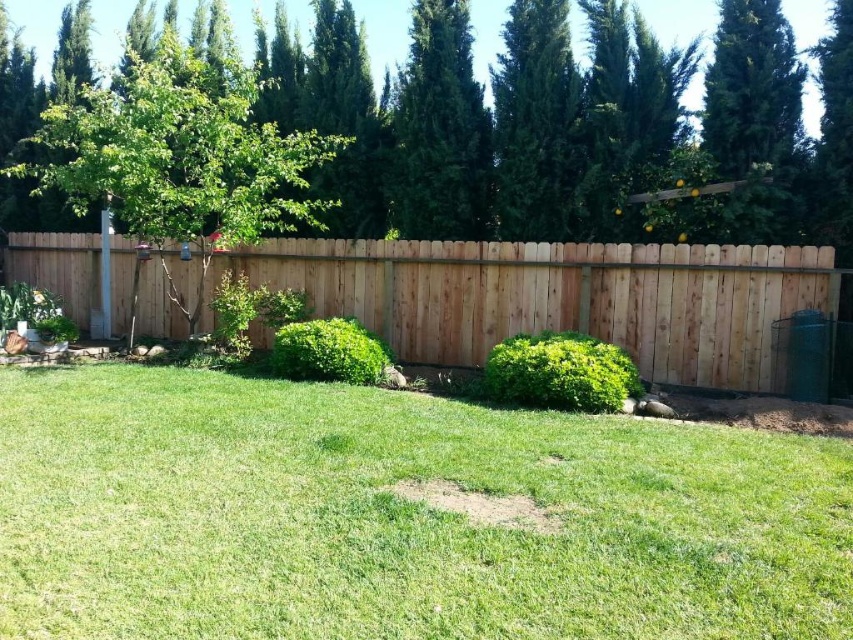
The height and width of the screenshot is (640, 853). What do you see at coordinates (398, 516) in the screenshot?
I see `green grass at center` at bounding box center [398, 516].

What do you see at coordinates (398, 516) in the screenshot? Image resolution: width=853 pixels, height=640 pixels. I see `green grass at center` at bounding box center [398, 516].

The image size is (853, 640). What are the coordinates of `green grass at center` in the screenshot? It's located at (398, 516).

Between point (131, 51) and point (479, 216), which one is positioned behind?

Point (131, 51)

Image resolution: width=853 pixels, height=640 pixels. What do you see at coordinates (180, 157) in the screenshot?
I see `green leafy tree at left` at bounding box center [180, 157].

You are a GUI agent. You are given a task and a screenshot of the screen. Output one action in this format:
    pyautogui.click(x=<x>, y=<y>)
    Task: Click on the green leafy tree at left
    The width and height of the screenshot is (853, 640).
    Given the screenshot: What is the action you would take?
    pyautogui.click(x=180, y=157)

Does green leafy tree at upper center have a larger size compared to green leafy tree at left?

Incorrect, green leafy tree at upper center is not larger than green leafy tree at left.

Can you confirm if green leafy tree at upper center is shorter than green leafy tree at left?

Indeed, green leafy tree at upper center has a lesser height compared to green leafy tree at left.

Does point (631, 74) lie in front of point (154, 246)?

Yes, point (631, 74) is in front of point (154, 246).

Where is `green leafy tree at upper center`? Image resolution: width=853 pixels, height=640 pixels. green leafy tree at upper center is located at coordinates (567, 125).